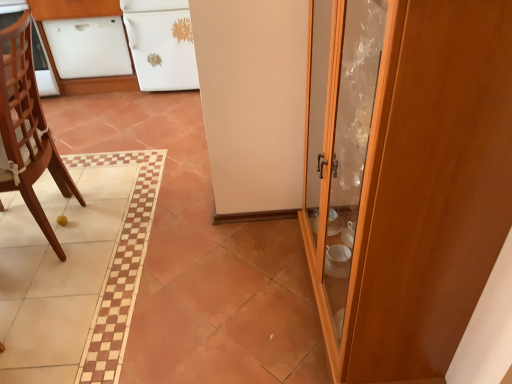
The image size is (512, 384). Describe the element at coordinates (88, 47) in the screenshot. I see `white glossy dishwasher at upper left, placed as the second cabinetry when sorted from right to left` at that location.

In order to face white glossy dishwasher at upper left, placed as the second cabinetry when sorted from right to left, should I rotate leftwards or rightwards?

To align with it, rotate left about 20.310°.

Locate an element on the screen. wooden chair at left is located at coordinates (27, 128).

Identify the location of white glossy cabinet at upper left, the 2th cabinetry when ordered from left to right. (161, 44).

Consider the image. Considering the relative sizes of white glossy dishwasher at upper left, acting as the 1th cabinetry starting from the left, and wooden cabinet at right in the image provided, is white glossy dishwasher at upper left, acting as the 1th cabinetry starting from the left, wider than wooden cabinet at right?

Correct, the width of white glossy dishwasher at upper left, acting as the 1th cabinetry starting from the left, exceeds that of wooden cabinet at right.

How many degrees apart are the facing directions of white glossy dishwasher at upper left, placed as the second cabinetry when sorted from right to left, and wooden cabinet at right?

white glossy dishwasher at upper left, placed as the second cabinetry when sorted from right to left, and wooden cabinet at right are facing 90 degrees away from each other.

Between white glossy dishwasher at upper left, placed as the second cabinetry when sorted from right to left, and wooden cabinet at right, which one has more height?

With more height is wooden cabinet at right.

Is point (72, 67) in front of point (503, 82)?

No, it is not.

Is white glossy cabinet at upper left, acting as the first cabinetry starting from the right, to the right of white glossy dishwasher at upper left, acting as the 1th cabinetry starting from the left, from the viewer's perspective?

Yes, white glossy cabinet at upper left, acting as the first cabinetry starting from the right, is to the right of white glossy dishwasher at upper left, acting as the 1th cabinetry starting from the left.

Looking at this image, how distant is white glossy cabinet at upper left, acting as the first cabinetry starting from the right, from white glossy dishwasher at upper left, acting as the 1th cabinetry starting from the left?

white glossy cabinet at upper left, acting as the first cabinetry starting from the right, is 11.90 inches from white glossy dishwasher at upper left, acting as the 1th cabinetry starting from the left.

You are a GUI agent. You are given a task and a screenshot of the screen. Output one action in this format:
    pyautogui.click(x=<x>, y=<y>)
    Task: Click on the cabinetry located on the right of white glossy dishwasher at upper left, acting as the 1th cabinetry starting from the left
    
    Given the screenshot: What is the action you would take?
    pyautogui.click(x=161, y=44)

Is white glossy cabinet at upper left, acting as the first cabinetry starting from the right, not close to white glossy dishwasher at upper left, acting as the 1th cabinetry starting from the left?

They are positioned close to each other.

Based on the photo, is wooden cabinet at right behind white glossy dishwasher at upper left, placed as the second cabinetry when sorted from right to left?

No, it is in front of white glossy dishwasher at upper left, placed as the second cabinetry when sorted from right to left.

Does wooden cabinet at right have a lesser width compared to white glossy dishwasher at upper left, acting as the 1th cabinetry starting from the left?

Correct, the width of wooden cabinet at right is less than that of white glossy dishwasher at upper left, acting as the 1th cabinetry starting from the left.

From a real-world perspective, is wooden cabinet at right above or below white glossy dishwasher at upper left, placed as the second cabinetry when sorted from right to left?

Clearly, from a real-world perspective, wooden cabinet at right is above white glossy dishwasher at upper left, placed as the second cabinetry when sorted from right to left.

From the picture: From a real-world perspective, does wooden chair at left sit lower than white glossy cabinet at upper left, acting as the first cabinetry starting from the right?

Actually, wooden chair at left is physically above white glossy cabinet at upper left, acting as the first cabinetry starting from the right, in the real world.

Consider the image. Based on their positions, is wooden chair at left located to the left or right of white glossy cabinet at upper left, acting as the first cabinetry starting from the right?

In the image, wooden chair at left appears on the left side of white glossy cabinet at upper left, acting as the first cabinetry starting from the right.

Looking at this image, is wooden chair at left placed right next to white glossy cabinet at upper left, acting as the first cabinetry starting from the right?

No.

Can you confirm if wooden chair at left is smaller than wooden cabinet at right?

Yes.

Is the depth of wooden chair at left less than that of wooden cabinet at right?

That is False.

From the image's perspective, is wooden chair at left beneath wooden cabinet at right?

No, from the image's perspective, wooden chair at left is not below wooden cabinet at right.

Where is `chair that appears on the right of white glossy dishwasher at upper left, acting as the 1th cabinetry starting from the left`? chair that appears on the right of white glossy dishwasher at upper left, acting as the 1th cabinetry starting from the left is located at coordinates (27, 128).

Which point is more distant from viewer, (96, 75) or (2, 88)?

Point (96, 75)

Is white glossy dishwasher at upper left, acting as the 1th cabinetry starting from the left, spatially inside wooden chair at left, or outside of it?

white glossy dishwasher at upper left, acting as the 1th cabinetry starting from the left, exists outside the volume of wooden chair at left.

Is white glossy dishwasher at upper left, acting as the 1th cabinetry starting from the left, closer to camera compared to white glossy cabinet at upper left, acting as the first cabinetry starting from the right?

No, it is not.

How different are the orientations of white glossy dishwasher at upper left, placed as the second cabinetry when sorted from right to left, and white glossy cabinet at upper left, acting as the first cabinetry starting from the right, in degrees?

The angle between the facing direction of white glossy dishwasher at upper left, placed as the second cabinetry when sorted from right to left, and the facing direction of white glossy cabinet at upper left, acting as the first cabinetry starting from the right, is 0.000125 degrees.

From the image's perspective, between white glossy dishwasher at upper left, placed as the second cabinetry when sorted from right to left, and white glossy cabinet at upper left, the 2th cabinetry when ordered from left to right, who is located below?

From the image's view, white glossy dishwasher at upper left, placed as the second cabinetry when sorted from right to left, is below.

Where is `cabinetry that is the 1st object located above the wooden cabinet at right (from the image's perspective)`? cabinetry that is the 1st object located above the wooden cabinet at right (from the image's perspective) is located at coordinates tap(88, 47).

Image resolution: width=512 pixels, height=384 pixels. What are the coordinates of `cabinetry in front of the white glossy dishwasher at upper left, acting as the 1th cabinetry starting from the left` in the screenshot? It's located at (161, 44).

From the image, which object appears to be nearer to wooden cabinet at right, white glossy cabinet at upper left, the 2th cabinetry when ordered from left to right, or white glossy dishwasher at upper left, placed as the second cabinetry when sorted from right to left?

Based on the image, white glossy cabinet at upper left, the 2th cabinetry when ordered from left to right, appears to be nearer to wooden cabinet at right.

When comparing their distances from wooden chair at left, does white glossy cabinet at upper left, acting as the first cabinetry starting from the right, or white glossy dishwasher at upper left, acting as the 1th cabinetry starting from the left, seem further?

white glossy dishwasher at upper left, acting as the 1th cabinetry starting from the left, is further to wooden chair at left.

Based on the photo, looking at the image, which one is located further to wooden cabinet at right, wooden chair at left or white glossy cabinet at upper left, acting as the first cabinetry starting from the right?

The object further to wooden cabinet at right is white glossy cabinet at upper left, acting as the first cabinetry starting from the right.

Which object lies nearer to the anchor point white glossy dishwasher at upper left, acting as the 1th cabinetry starting from the left, white glossy cabinet at upper left, acting as the first cabinetry starting from the right, or wooden cabinet at right?

Based on the image, white glossy cabinet at upper left, acting as the first cabinetry starting from the right, appears to be nearer to white glossy dishwasher at upper left, acting as the 1th cabinetry starting from the left.

From the image, which object appears to be nearer to white glossy dishwasher at upper left, acting as the 1th cabinetry starting from the left, white glossy cabinet at upper left, the 2th cabinetry when ordered from left to right, or wooden chair at left?

white glossy cabinet at upper left, the 2th cabinetry when ordered from left to right, lies closer to white glossy dishwasher at upper left, acting as the 1th cabinetry starting from the left, than the other object.

When comparing their distances from white glossy cabinet at upper left, the 2th cabinetry when ordered from left to right, does wooden chair at left or wooden cabinet at right seem further?

wooden cabinet at right is further to white glossy cabinet at upper left, the 2th cabinetry when ordered from left to right.

Based on their spatial positions, is white glossy dishwasher at upper left, acting as the 1th cabinetry starting from the left, or wooden cabinet at right further from white glossy cabinet at upper left, the 2th cabinetry when ordered from left to right?

wooden cabinet at right is further to white glossy cabinet at upper left, the 2th cabinetry when ordered from left to right.

Considering their positions, is white glossy dishwasher at upper left, acting as the 1th cabinetry starting from the left, positioned closer to wooden cabinet at right than wooden chair at left?

The object closer to wooden cabinet at right is wooden chair at left.

This screenshot has width=512, height=384. I want to click on cabinetry positioned between wooden chair at left and white glossy dishwasher at upper left, acting as the 1th cabinetry starting from the left, from near to far, so click(161, 44).

Find the location of `chair located between wooden cabinet at right and white glossy cabinet at upper left, the 2th cabinetry when ordered from left to right, in the depth direction`. chair located between wooden cabinet at right and white glossy cabinet at upper left, the 2th cabinetry when ordered from left to right, in the depth direction is located at coordinates (27, 128).

Where is `chair between wooden cabinet at right and white glossy dishwasher at upper left, placed as the second cabinetry when sorted from right to left, from front to back`? This screenshot has width=512, height=384. chair between wooden cabinet at right and white glossy dishwasher at upper left, placed as the second cabinetry when sorted from right to left, from front to back is located at coordinates (27, 128).

Where is `cabinetry located between wooden cabinet at right and white glossy dishwasher at upper left, acting as the 1th cabinetry starting from the left, in the depth direction`? cabinetry located between wooden cabinet at right and white glossy dishwasher at upper left, acting as the 1th cabinetry starting from the left, in the depth direction is located at coordinates (161, 44).